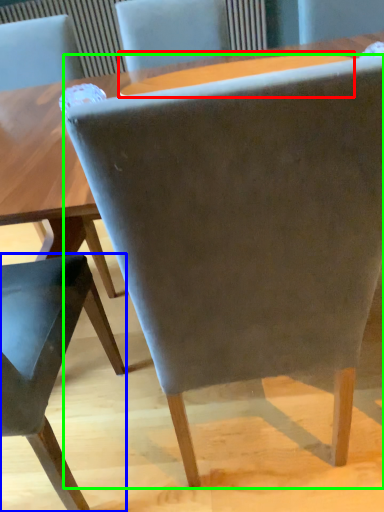
Question: Estimate the real-world distances between objects in this image. Which object is closer to round table (highlighted by a red box), chair (highlighted by a blue box) or chair (highlighted by a green box)?

Choices:
 (A) chair
 (B) chair

Answer: (A)